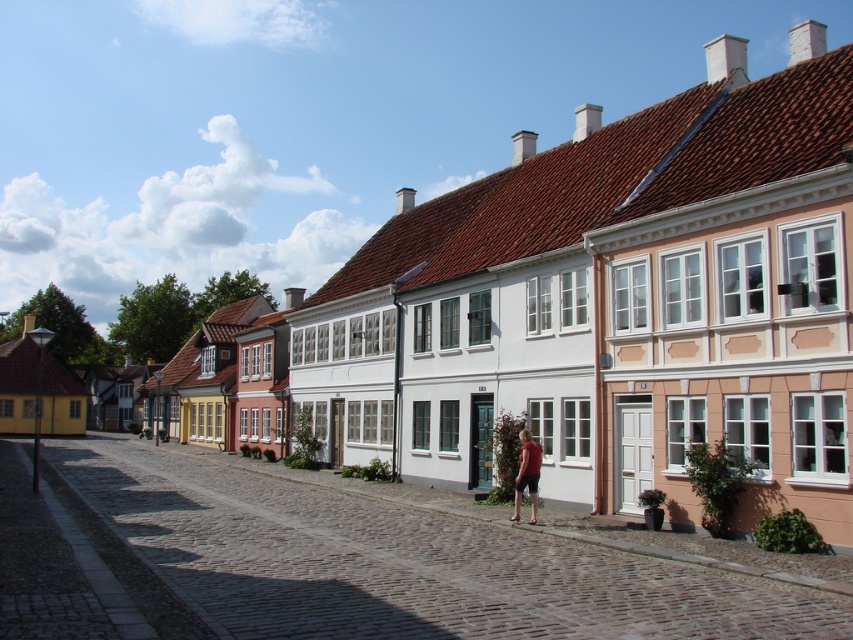
Question: From the image, what is the correct spatial relationship of cobblestone street at center in relation to matte red shirt at center?

Choices:
 (A) above
 (B) below

Answer: (B)

Question: Which object appears farthest from the camera in this image?

Choices:
 (A) matte red shirt at center
 (B) cobblestone street at center

Answer: (A)

Question: Considering the relative positions of cobblestone street at center and matte red shirt at center in the image provided, where is cobblestone street at center located with respect to matte red shirt at center?

Choices:
 (A) above
 (B) below

Answer: (B)

Question: Does cobblestone street at center appear on the left side of matte red shirt at center?

Choices:
 (A) no
 (B) yes

Answer: (B)